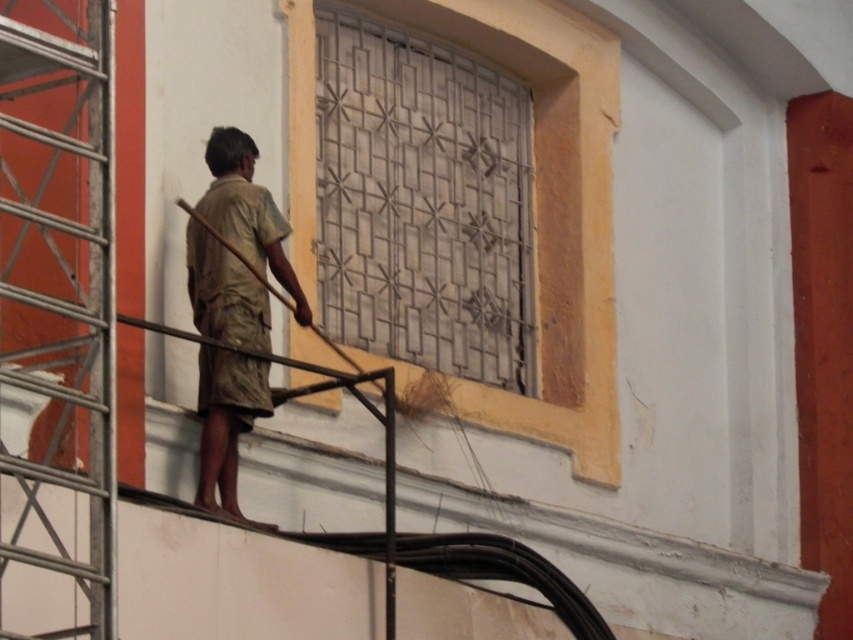
Question: Which point appears closest to the camera in this image?

Choices:
 (A) (558, 22)
 (B) (108, 150)

Answer: (B)

Question: Which point is farther to the camera?

Choices:
 (A) (589, 435)
 (B) (112, 262)

Answer: (A)

Question: Does metallic scaffolding at left have a smaller size compared to brown cotton shirt at center?

Choices:
 (A) no
 (B) yes

Answer: (A)

Question: Does metallic grid at center have a lesser width compared to brown cotton shirt at center?

Choices:
 (A) yes
 (B) no

Answer: (B)

Question: Which point is closer to the camera?

Choices:
 (A) (13, 394)
 (B) (218, 221)

Answer: (A)

Question: Can you confirm if metallic scaffolding at left is positioned to the right of brown cotton shirt at center?

Choices:
 (A) yes
 (B) no

Answer: (B)